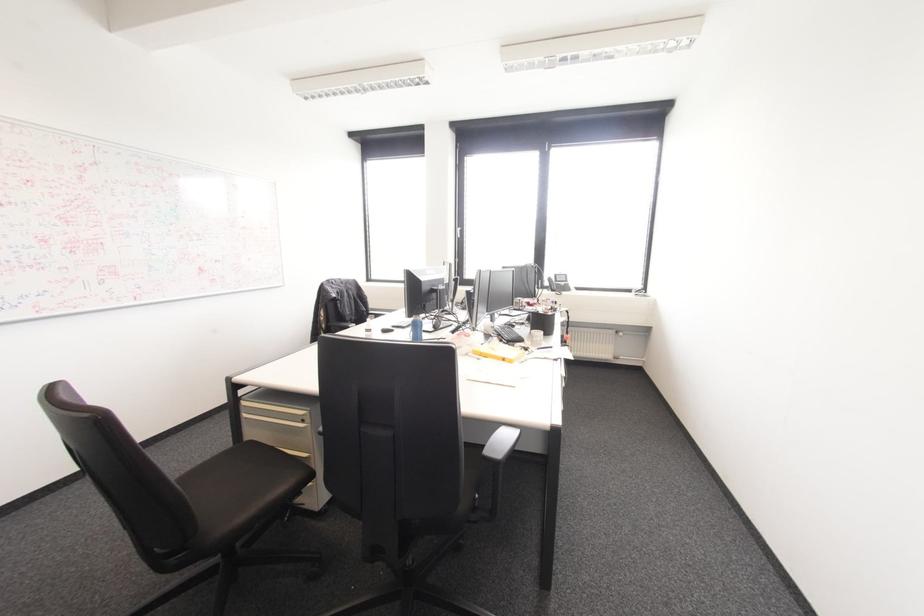
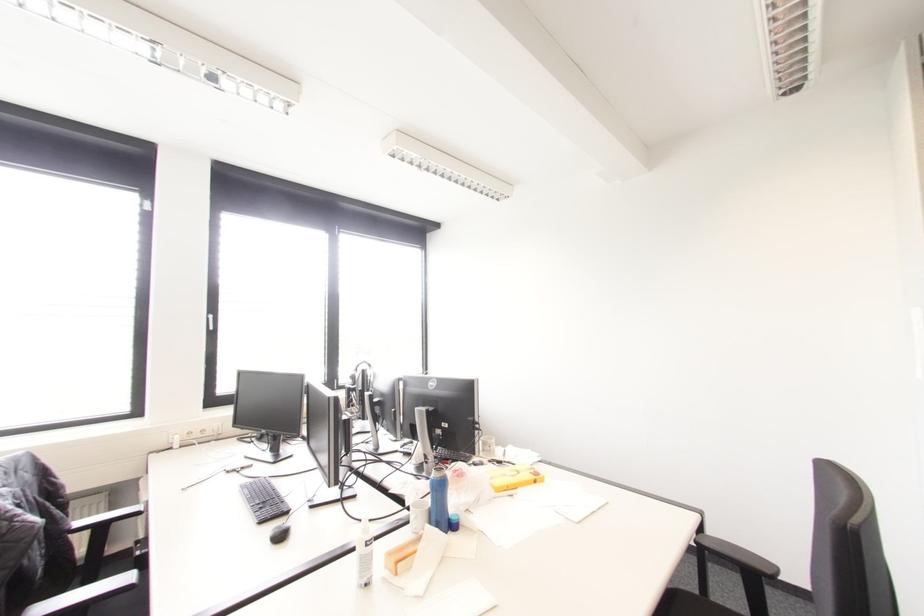
Question: I am providing you with two images of the same scene from different viewpoints. Which of the following objects are not visible in image2?

Choices:
 (A) blue water bottle
 (B) telephone handset
 (C) white window handle
 (D) black office chair armrest

Answer: (B)